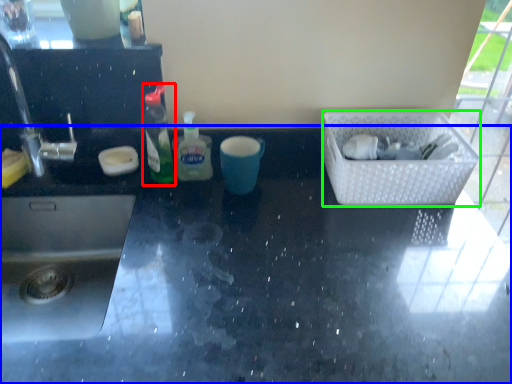
Question: Which object is the farthest from bottle (highlighted by a red box)? Choose among these: countertop (highlighted by a blue box) or basket (highlighted by a green box).

Choices:
 (A) countertop
 (B) basket

Answer: (B)